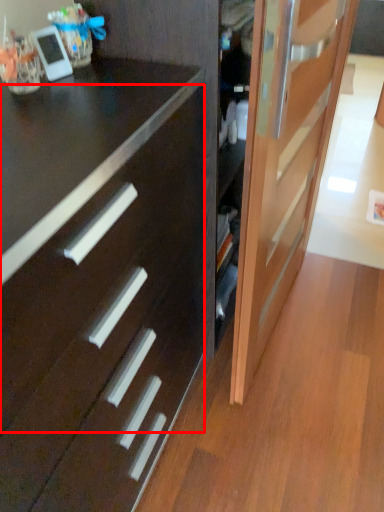
Question: From the image's perspective, where is drawer (annotated by the red box) located relative to door?

Choices:
 (A) below
 (B) above

Answer: (A)